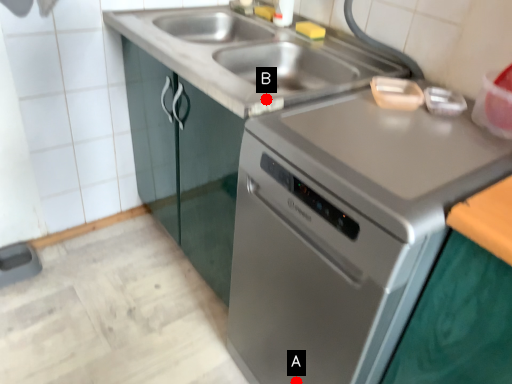
Question: Two points are circled on the image, labeled by A and B beside each circle. Which of the following is the closest to the observer?

Choices:
 (A) A is closer
 (B) B is closer

Answer: (B)